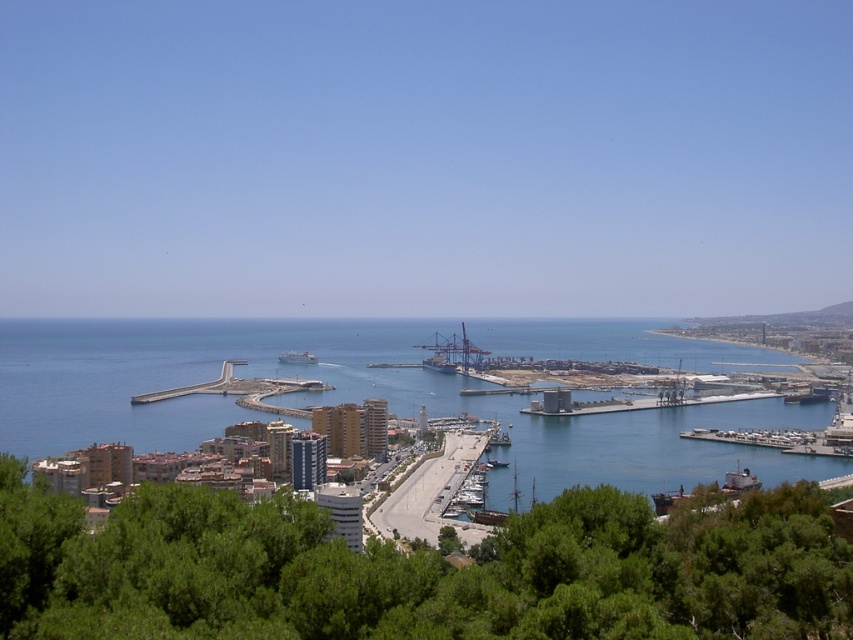
Does blue water at center have a lesser height compared to metallic blue cargo ship at center?

No.

Is point (0, 422) closer to camera compared to point (444, 371)?

No, (0, 422) is further to viewer.

This screenshot has height=640, width=853. In order to click on blue water at center in this screenshot , I will do `click(354, 401)`.

Between blue water at center and white matte ship at center, which one has less height?

white matte ship at center is shorter.

The height and width of the screenshot is (640, 853). I want to click on blue water at center, so click(354, 401).

Between metallic blue cargo ship at center and white matte ship at center, which one is positioned higher?

Positioned higher is white matte ship at center.

Between metallic blue cargo ship at center and white matte ship at center, which one has less height?

With less height is white matte ship at center.

Which is in front, point (450, 364) or point (280, 353)?

Point (450, 364)

The image size is (853, 640). What are the coordinates of `metallic blue cargo ship at center` in the screenshot? It's located at (438, 364).